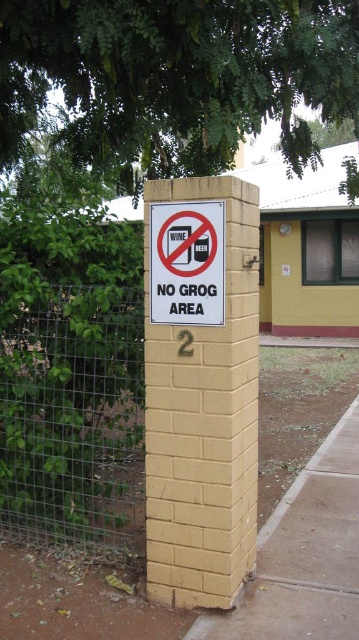
Which is below, green leafy tree at upper center or yellow brick post at center?

yellow brick post at center

Does green leafy tree at upper center lie in front of yellow brick post at center?

No, it is not.

Who is more forward, [10,106] or [236,568]?

Positioned in front is point [236,568].

The height and width of the screenshot is (640, 359). Find the location of `green leafy tree at upper center`. green leafy tree at upper center is located at coordinates (174, 77).

Between green leafy tree at upper center and white paper sign at center, which one appears on the left side from the viewer's perspective?

green leafy tree at upper center

Who is shorter, green leafy tree at upper center or white paper sign at center?

With less height is white paper sign at center.

The width and height of the screenshot is (359, 640). What do you see at coordinates (174, 77) in the screenshot? I see `green leafy tree at upper center` at bounding box center [174, 77].

At what (x,y) coordinates should I click in order to perform the action: click on green leafy tree at upper center. Please return your answer as a coordinate pair (x, y). This screenshot has width=359, height=640. Looking at the image, I should click on (174, 77).

Is wire mesh fence at left shorter than white paper sign at center?

Incorrect, wire mesh fence at left's height does not fall short of white paper sign at center's.

Between wire mesh fence at left and white paper sign at center, which one has more height?

wire mesh fence at left is taller.

Describe the element at coordinates (72, 417) in the screenshot. I see `wire mesh fence at left` at that location.

I want to click on wire mesh fence at left, so click(72, 417).